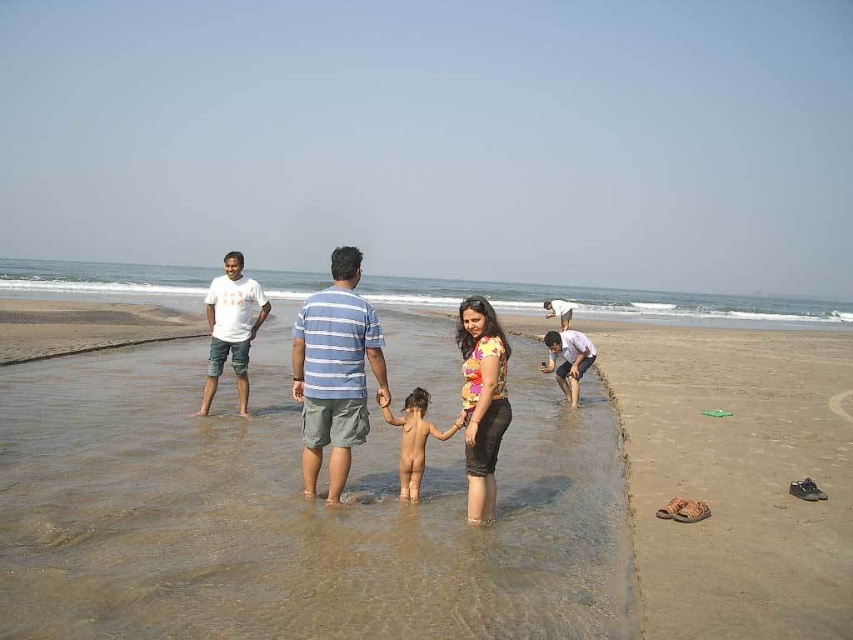
You are a photographer trying to capture a photo of the striped cotton shirt at center and the brown sand at center. Which object will appear larger in the photo?

The brown sand at center will appear larger in the photo because it is bigger than the striped cotton shirt at center.

You are standing on the beach and want to walk from the striped cotton shirt at center to the brown sand at center. In which direction should you move?

You should move to the right to reach the brown sand at center from the striped cotton shirt at center because the brown sand at center is located to the right of the striped cotton shirt at center.

You are a photographer trying to capture a candid shot of the scene. You notice the clear water at center and the nude skin at center. Based on their positions, which object is located to the right of the other?

The clear water at center is positioned on the right side of nude skin at center, so the clear water at center is to the right of the nude skin at center.